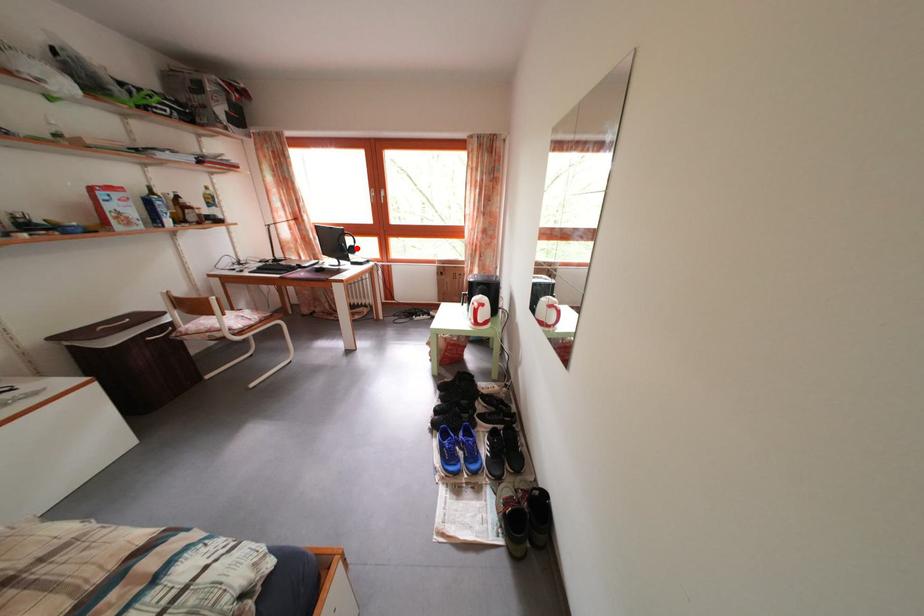
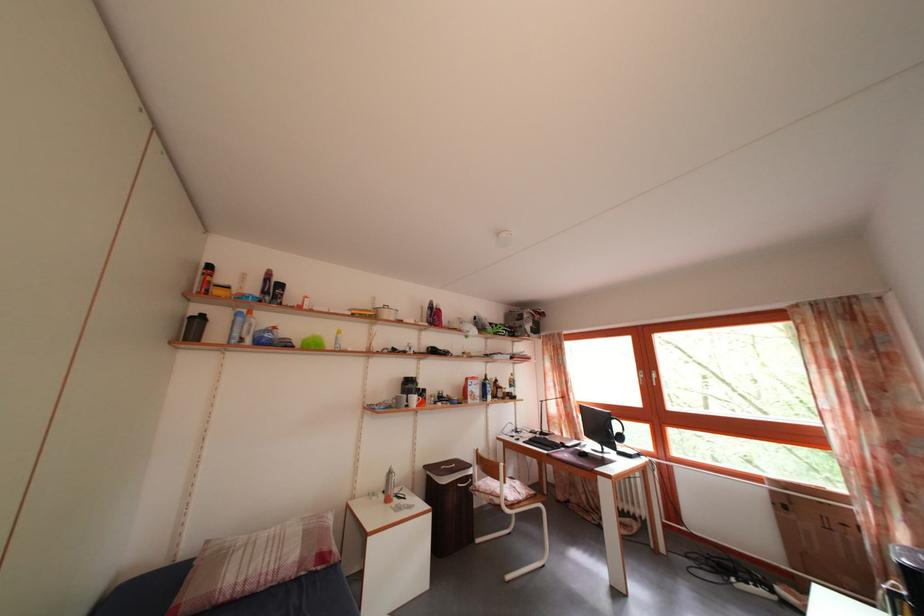
Locate, in the second image, the point that corresponds to the highlighted location in the first image.

(624, 434)